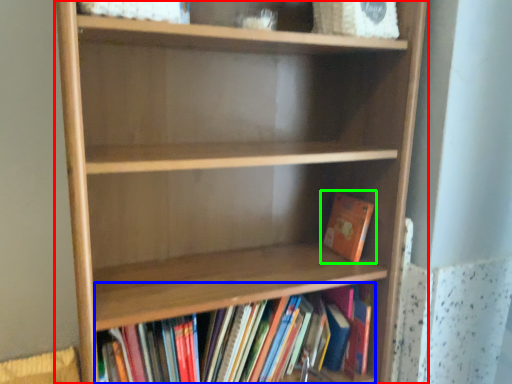
Question: Which is nearer to the shelf (highlighted by a red box)? book (highlighted by a blue box) or book (highlighted by a green box).

Choices:
 (A) book
 (B) book

Answer: (A)